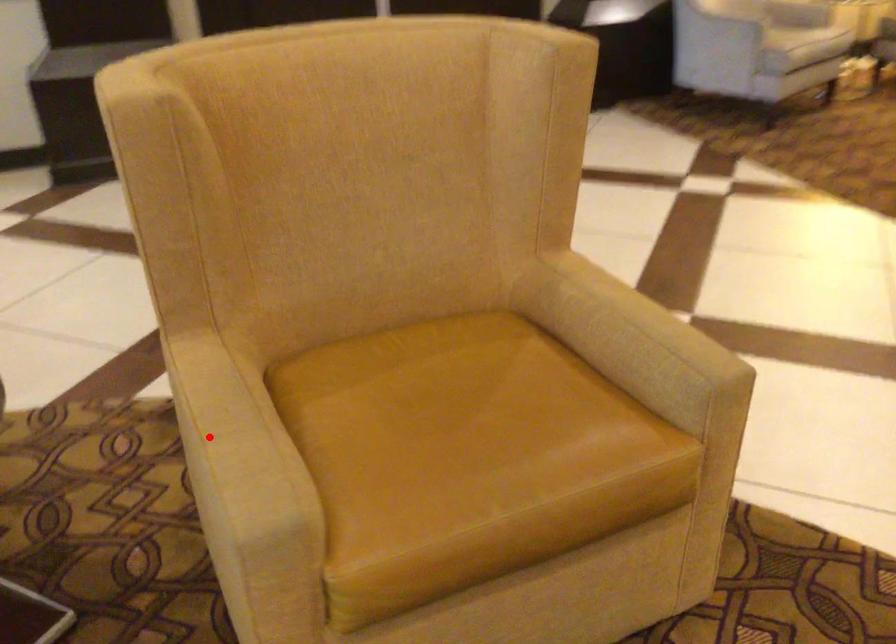
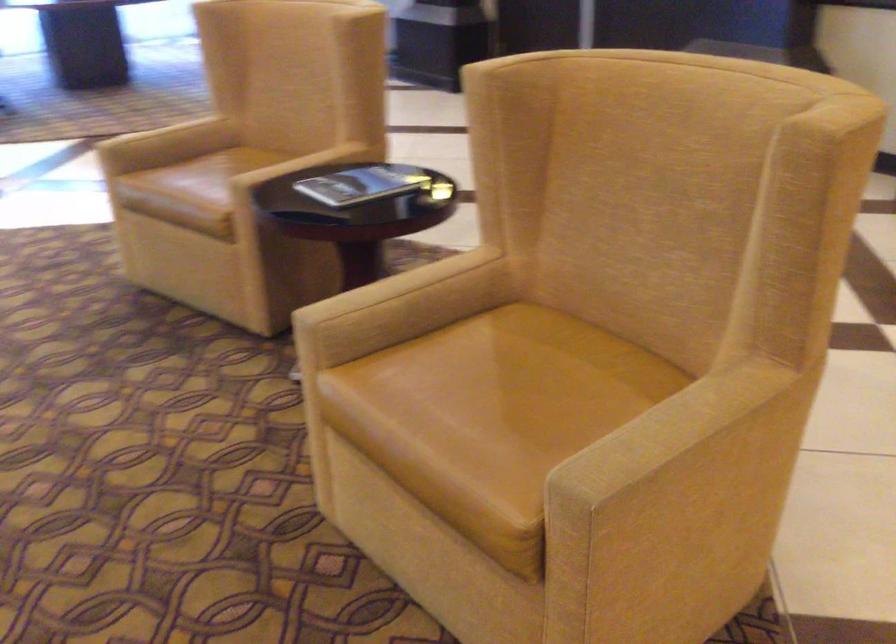
Question: I am providing you with two images of the same scene from different viewpoints. In image1, a red point is highlighted. Considering the same 3D point in image2, which of the following is correct?

Choices:
 (A) It is closer
 (B) It is farther

Answer: (B)